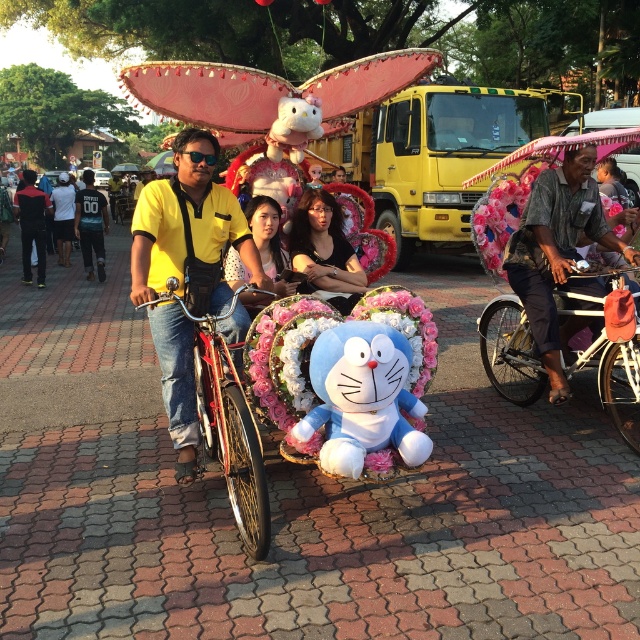
You are a photographer trying to capture a clear shot of both the blue plush toy at center and the black matte dress at center. Based on their positions, which object should you focus on first to ensure both are in the frame?

The blue plush toy at center is in front of the black matte dress at center, so you should focus on the blue plush toy at center first to ensure both are visible in the frame.